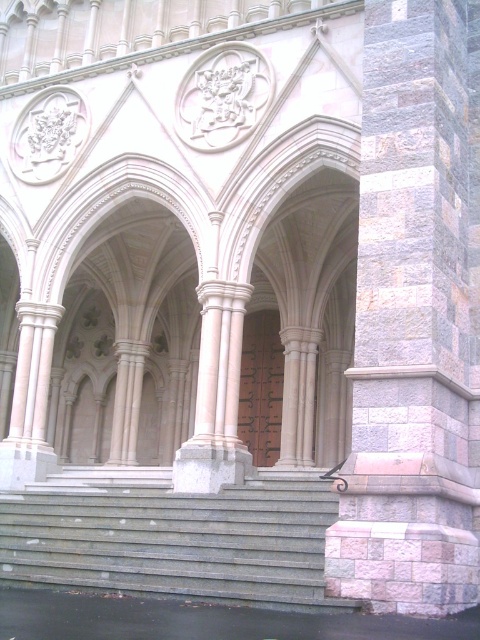
Question: Which object is the farthest from the stone textured pillar at right?

Choices:
 (A) gray stone stairs at lower left
 (B) brown wooden door at center

Answer: (B)

Question: Does stone textured pillar at right lie behind gray stone stairs at lower left?

Choices:
 (A) yes
 (B) no

Answer: (B)

Question: Which object is the closest to the stone textured pillar at right?

Choices:
 (A) brown wooden door at center
 (B) gray stone stairs at lower left

Answer: (B)

Question: Can you confirm if stone textured pillar at right is positioned above gray stone stairs at lower left?

Choices:
 (A) no
 (B) yes

Answer: (B)

Question: Can you confirm if gray stone stairs at lower left is positioned above brown wooden door at center?

Choices:
 (A) no
 (B) yes

Answer: (A)

Question: Which point appears farthest from the camera in this image?

Choices:
 (A) (435, 28)
 (B) (287, 586)
 (C) (264, 348)

Answer: (C)